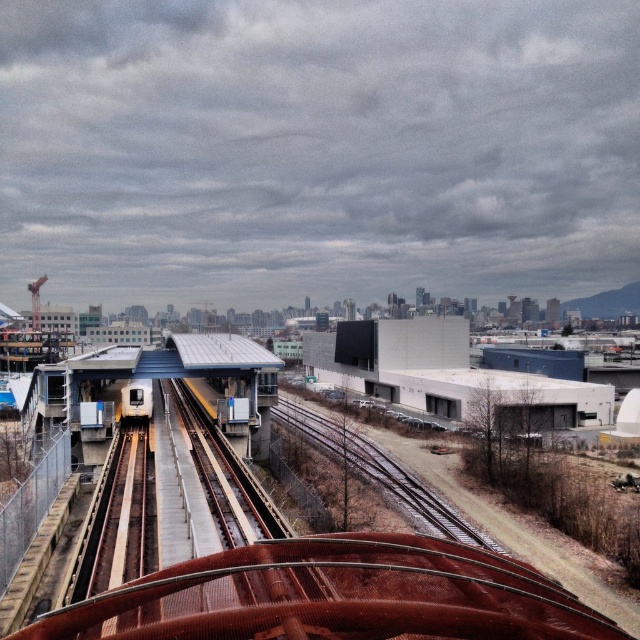
Question: Is gray concrete building at center wider than metallic silver train at center?

Choices:
 (A) yes
 (B) no

Answer: (A)

Question: Among these objects, which one is farthest from the camera?

Choices:
 (A) gray concrete building at center
 (B) metallic silver train at center

Answer: (B)

Question: Is gray concrete building at center above metallic silver train at center?

Choices:
 (A) yes
 (B) no

Answer: (A)

Question: Which of the following is the closest to the observer?

Choices:
 (A) metallic silver train at center
 (B) gray concrete building at center

Answer: (B)

Question: Is gray concrete building at center closer to camera compared to metallic silver train at center?

Choices:
 (A) yes
 (B) no

Answer: (A)